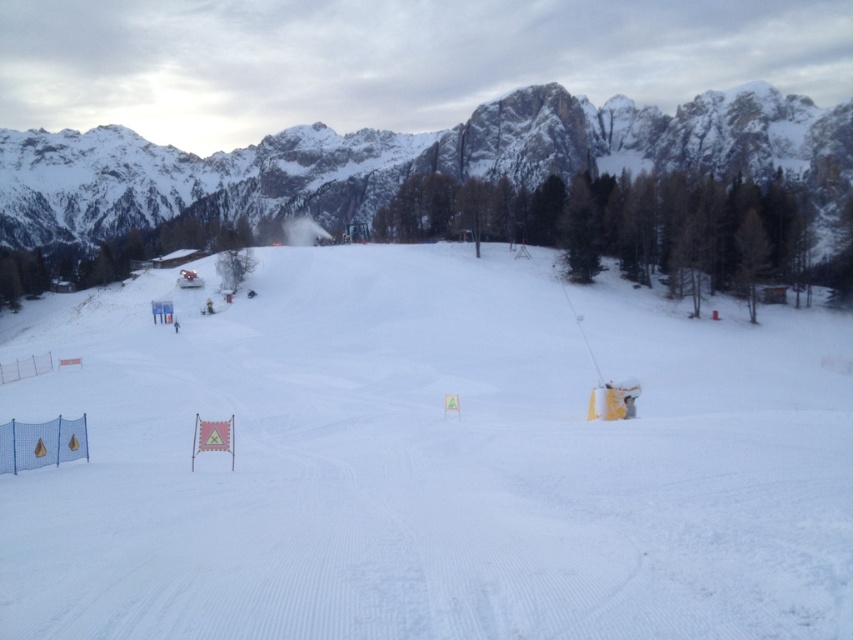
Between white powdery snow at center and snowy granite mountain at upper center, which one is positioned higher?

snowy granite mountain at upper center is higher up.

Describe the element at coordinates (432, 461) in the screenshot. The height and width of the screenshot is (640, 853). I see `white powdery snow at center` at that location.

Identify the location of white powdery snow at center. Image resolution: width=853 pixels, height=640 pixels. point(432,461).